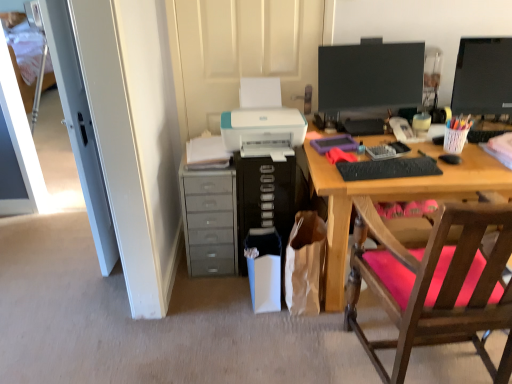
Question: Is black plastic computer tower at center at the back of white fabric bed at left?

Choices:
 (A) yes
 (B) no

Answer: (B)

Question: From a real-world perspective, does white fabric bed at left stand above black plastic computer tower at center?

Choices:
 (A) yes
 (B) no

Answer: (A)

Question: Considering the relative sizes of white fabric bed at left and black plastic computer tower at center in the image provided, is white fabric bed at left wider than black plastic computer tower at center?

Choices:
 (A) no
 (B) yes

Answer: (A)

Question: Does white fabric bed at left turn towards black plastic computer tower at center?

Choices:
 (A) no
 (B) yes

Answer: (A)

Question: Is white fabric bed at left to the left of black plastic computer tower at center from the viewer's perspective?

Choices:
 (A) no
 (B) yes

Answer: (B)

Question: Is black matte keyboard at center taller or shorter than matte black monitor at upper right, the 1th computer monitor from the right?

Choices:
 (A) tall
 (B) short

Answer: (B)

Question: Considering the positions of point (424, 155) and point (496, 97), is point (424, 155) closer or farther from the camera than point (496, 97)?

Choices:
 (A) closer
 (B) farther

Answer: (A)

Question: Considering the relative positions of black matte keyboard at center and matte black monitor at upper right, the 2th computer monitor from the left, in the image provided, is black matte keyboard at center to the left or to the right of matte black monitor at upper right, the 2th computer monitor from the left,?

Choices:
 (A) left
 (B) right

Answer: (A)

Question: From the image's perspective, is black matte keyboard at center located above or below matte black monitor at upper right, the 2th computer monitor from the left?

Choices:
 (A) above
 (B) below

Answer: (B)

Question: From the image's perspective, is matte black monitor at upper right, the 2th computer monitor from the left, located above or below translucent plastic pencil case at center, which ranks as the 3th stationery in bottom-to-top order?

Choices:
 (A) above
 (B) below

Answer: (A)

Question: In terms of size, does matte black monitor at upper right, the 2th computer monitor from the left, appear bigger or smaller than translucent plastic pencil case at center, arranged as the third stationery when viewed from the left?

Choices:
 (A) small
 (B) big

Answer: (B)

Question: Do you think matte black monitor at upper right, the 2th computer monitor from the left, is within translucent plastic pencil case at center, which ranks as the 3th stationery in bottom-to-top order, or outside of it?

Choices:
 (A) inside
 (B) outside

Answer: (B)

Question: Considering the positions of point (510, 100) and point (415, 132), is point (510, 100) closer or farther from the camera than point (415, 132)?

Choices:
 (A) farther
 (B) closer

Answer: (A)

Question: Would you say clear plastic tray at upper right is inside or outside black plastic computer tower at center?

Choices:
 (A) outside
 (B) inside

Answer: (A)

Question: From a real-world perspective, relative to black plastic computer tower at center, is clear plastic tray at upper right vertically above or below?

Choices:
 (A) below
 (B) above

Answer: (B)